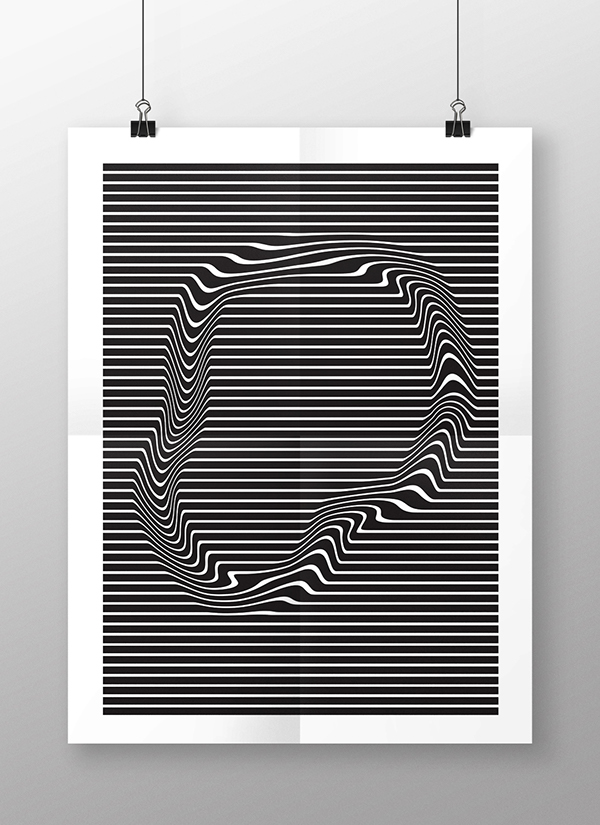
Where is `wall`? wall is located at coordinates (251, 120).